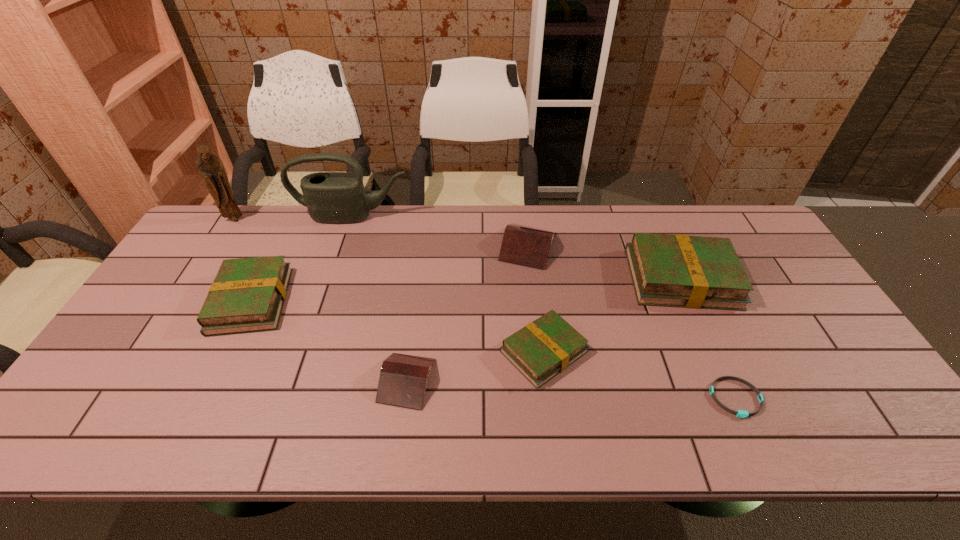
Where is `figurine`? The height and width of the screenshot is (540, 960). figurine is located at coordinates (209, 166).

This screenshot has width=960, height=540. Identify the location of the leftmost object. (209, 166).

Find the location of a particular element. The image size is (960, 540). the second tallest object is located at coordinates coord(331,197).

Locate an element on the screen. This screenshot has width=960, height=540. green watering can is located at coordinates (331, 197).

This screenshot has height=540, width=960. What are the coordinates of `the rightmost book` in the screenshot? It's located at (686, 271).

The image size is (960, 540). What are the coordinates of `the rightmost yellow book` in the screenshot? It's located at (686, 271).

The image size is (960, 540). What are the coordinates of `the farther brown book` in the screenshot? It's located at (523, 245).

The image size is (960, 540). Find the location of `the right brown book`. the right brown book is located at coordinates (523, 245).

At what (x,y) coordinates should I click in order to perform the action: click on the leftmost yellow book. Please return your answer as a coordinate pair (x, y). Image resolution: width=960 pixels, height=540 pixels. Looking at the image, I should click on (248, 294).

Locate an element on the screen. This screenshot has width=960, height=540. the leftmost book is located at coordinates (248, 294).